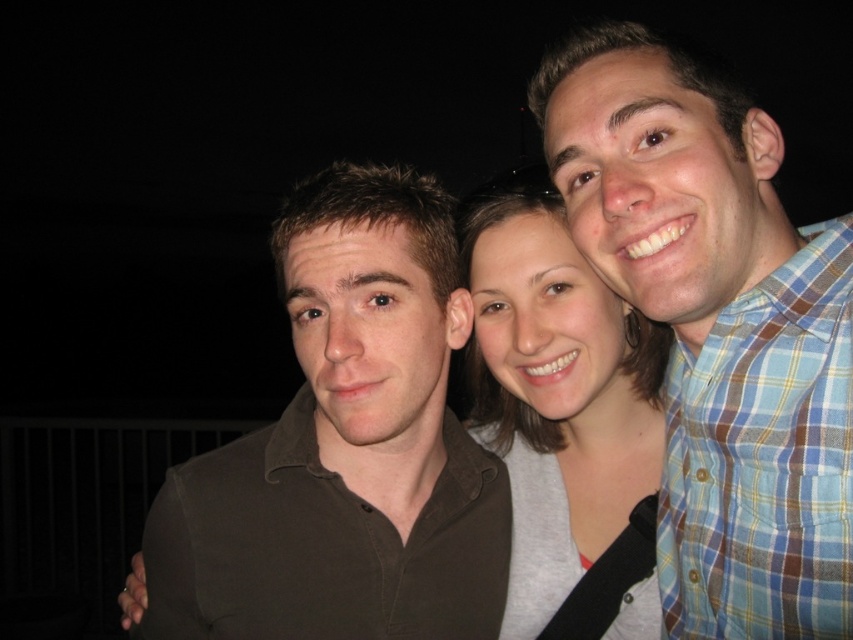
In the nighttime photo, there are two shirts visible at the center of the image. The dark brown cotton shirt at center and the matte gray shirt at center. Which shirt is positioned to the left of the other?

The dark brown cotton shirt at center is to the left of the matte gray shirt at center.

You are standing at point (x=646, y=240) and want to take a photo of the three people in the scene. The camera you have can focus on subjects within 35 inches. Will the camera be able to focus on the three people?

The distance between point (x=646, y=240) and the camera is 34.83 inches, which is within the camera focus range of 35 inches. Therefore, the camera can focus on the three people.